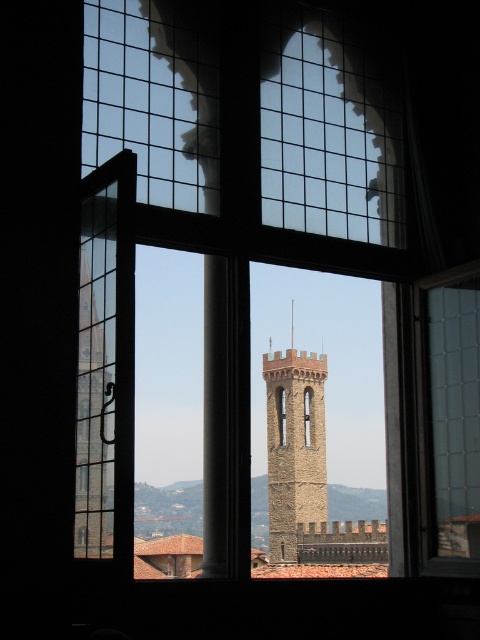
You are an architect designing a new garden path between the stone tower at left and the brown stone bell tower at center. The path must be straight and wide enough for a horse and carriage. Given that the distance between them is 95.86 meters, what is the minimum width required for the path to accommodate a standard horse and carriage?

The minimum width required for a path to accommodate a standard horse and carriage is typically around 4 meters. Since the distance between the stone tower at left and the brown stone bell tower at center is 95.86 meters, the path must be at least 4 meters wide to ensure safe passage for the carriage.

You are an architect examining the window view. You notice the stone tower at left and the brown stone bell tower at center. Which one appears higher in the frame?

The stone tower at left is located above the brown stone bell tower at center, so it appears higher in the frame.